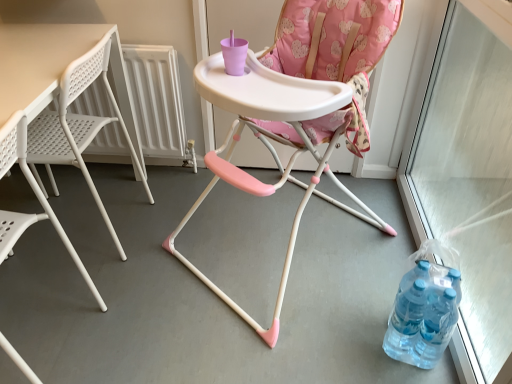
Question: From a real-world perspective, is white plastic table at left on white plastic chair at left, which appears as the first chair when viewed from the left?

Choices:
 (A) yes
 (B) no

Answer: (B)

Question: Would you say white plastic table at left is outside white plastic chair at left, the second chair when ordered from right to left?

Choices:
 (A) yes
 (B) no

Answer: (A)

Question: Is white plastic table at left wider than white plastic chair at left, which appears as the first chair when viewed from the left?

Choices:
 (A) no
 (B) yes

Answer: (B)

Question: Is white plastic table at left turned away from white plastic chair at left, the second chair when ordered from right to left?

Choices:
 (A) yes
 (B) no

Answer: (B)

Question: From the image's perspective, is white plastic table at left located above white plastic chair at left, which appears as the first chair when viewed from the left?

Choices:
 (A) no
 (B) yes

Answer: (B)

Question: Based on their sizes in the image, would you say transparent plastic screen door at right is bigger or smaller than white plastic chair at left, the second chair when ordered from right to left?

Choices:
 (A) big
 (B) small

Answer: (A)

Question: Looking at their shapes, would you say transparent plastic screen door at right is wider or thinner than white plastic chair at left, the second chair when ordered from right to left?

Choices:
 (A) thin
 (B) wide

Answer: (A)

Question: From a real-world perspective, is transparent plastic screen door at right positioned above or below white plastic chair at left, which appears as the first chair when viewed from the left?

Choices:
 (A) above
 (B) below

Answer: (A)

Question: From the image's perspective, is transparent plastic screen door at right positioned above or below white plastic chair at left, the second chair when ordered from right to left?

Choices:
 (A) above
 (B) below

Answer: (A)

Question: Looking at their shapes, would you say translucent plastic bottles at lower right is wider or thinner than white plastic table at left?

Choices:
 (A) wide
 (B) thin

Answer: (B)

Question: Is translucent plastic bottles at lower right bigger or smaller than white plastic table at left?

Choices:
 (A) big
 (B) small

Answer: (B)

Question: In the image, is translucent plastic bottles at lower right on the left side or the right side of white plastic table at left?

Choices:
 (A) left
 (B) right

Answer: (B)

Question: From the image's perspective, relative to white plastic table at left, is translucent plastic bottles at lower right above or below?

Choices:
 (A) above
 (B) below

Answer: (B)

Question: Considering their positions, is white plastic table at left located in front of or behind white plastic radiator at left?

Choices:
 (A) behind
 (B) front

Answer: (B)

Question: Is white plastic table at left inside or outside of white plastic radiator at left?

Choices:
 (A) inside
 (B) outside

Answer: (B)